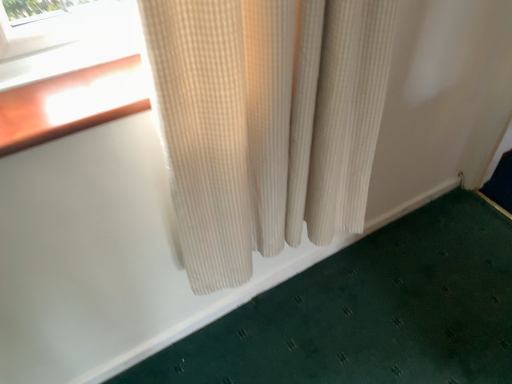
Question: Does green textured bath mat at lower right appear on the left side of beige corduroy curtain at center?

Choices:
 (A) yes
 (B) no

Answer: (B)

Question: Is beige corduroy curtain at center surrounded by green textured bath mat at lower right?

Choices:
 (A) yes
 (B) no

Answer: (B)

Question: Is green textured bath mat at lower right shorter than beige corduroy curtain at center?

Choices:
 (A) yes
 (B) no

Answer: (A)

Question: Considering the relative sizes of green textured bath mat at lower right and beige corduroy curtain at center in the image provided, is green textured bath mat at lower right wider than beige corduroy curtain at center?

Choices:
 (A) yes
 (B) no

Answer: (B)

Question: Is green textured bath mat at lower right facing towards beige corduroy curtain at center?

Choices:
 (A) yes
 (B) no

Answer: (B)

Question: From the image's perspective, does green textured bath mat at lower right appear higher than beige corduroy curtain at center?

Choices:
 (A) yes
 (B) no

Answer: (B)

Question: From a real-world perspective, is beige corduroy curtain at center physically above green textured bath mat at lower right?

Choices:
 (A) no
 (B) yes

Answer: (B)

Question: Is beige corduroy curtain at center at the right side of green textured bath mat at lower right?

Choices:
 (A) no
 (B) yes

Answer: (A)

Question: Is beige corduroy curtain at center closer to camera compared to green textured bath mat at lower right?

Choices:
 (A) no
 (B) yes

Answer: (B)

Question: From the image's perspective, is beige corduroy curtain at center under green textured bath mat at lower right?

Choices:
 (A) no
 (B) yes

Answer: (A)

Question: Considering the relative positions of beige corduroy curtain at center and green textured bath mat at lower right in the image provided, is beige corduroy curtain at center to the left of green textured bath mat at lower right from the viewer's perspective?

Choices:
 (A) yes
 (B) no

Answer: (A)

Question: Is beige corduroy curtain at center next to green textured bath mat at lower right and touching it?

Choices:
 (A) no
 (B) yes

Answer: (A)

Question: In the image, is green textured bath mat at lower right on the left side or the right side of beige corduroy curtain at center?

Choices:
 (A) right
 (B) left

Answer: (A)